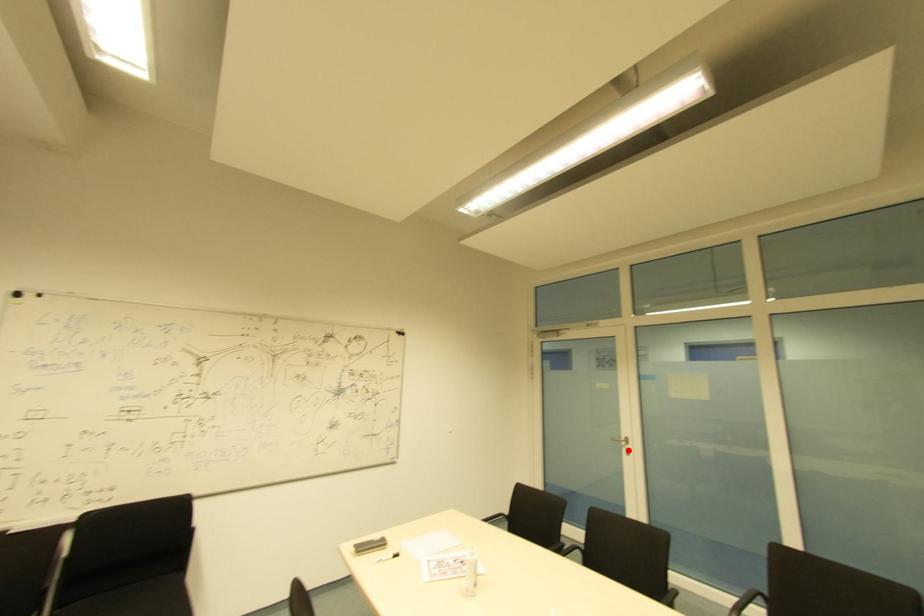
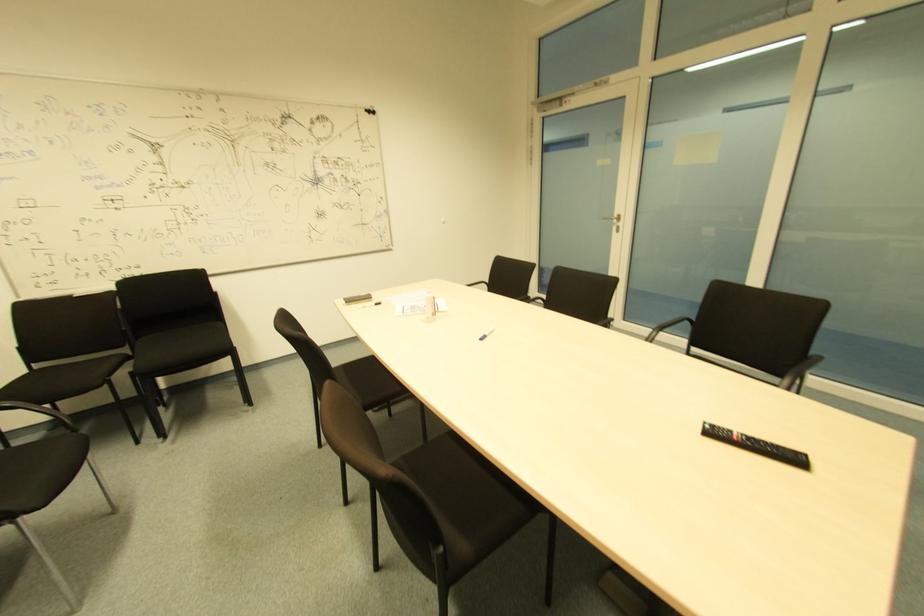
The point at the highlighted location is marked in the first image. Where is the corresponding point in the second image?

(618, 227)